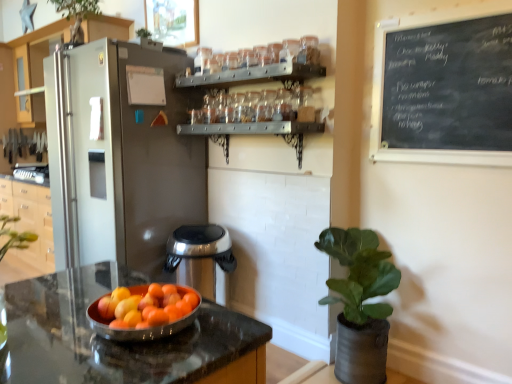
Identify the location of free space above shiny granite countertop at center (from a real-world perspective). The image size is (512, 384). (92, 316).